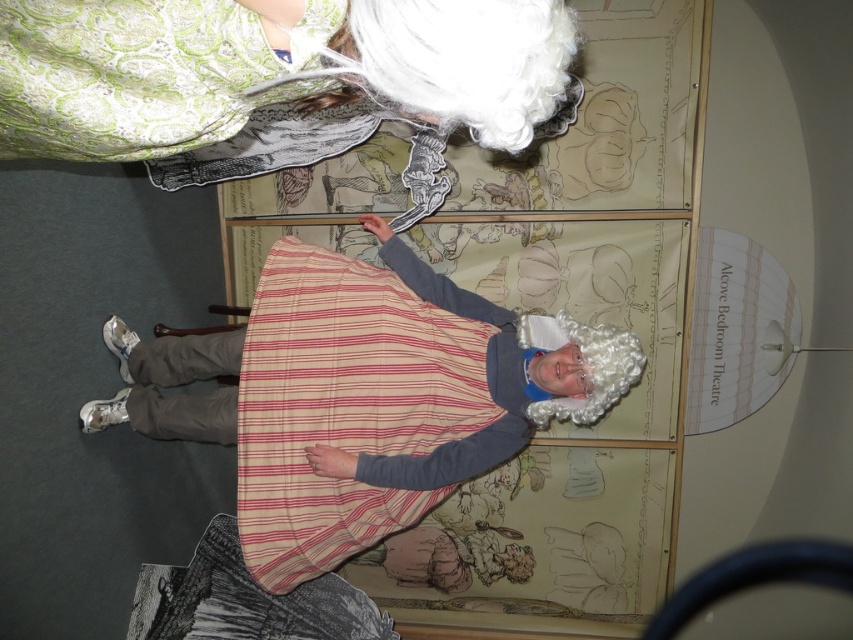
Between matte white wig at upper center and striped cotton apron at center, which one is positioned lower?

striped cotton apron at center is below.

Between point (355, 29) and point (426, 392), which one is positioned in front?

Positioned in front is point (355, 29).

You are a GUI agent. You are given a task and a screenshot of the screen. Output one action in this format:
    pyautogui.click(x=<x>, y=<y>)
    Task: Click on the matte white wig at upper center
    The height and width of the screenshot is (640, 853).
    Given the screenshot: What is the action you would take?
    pyautogui.click(x=265, y=67)